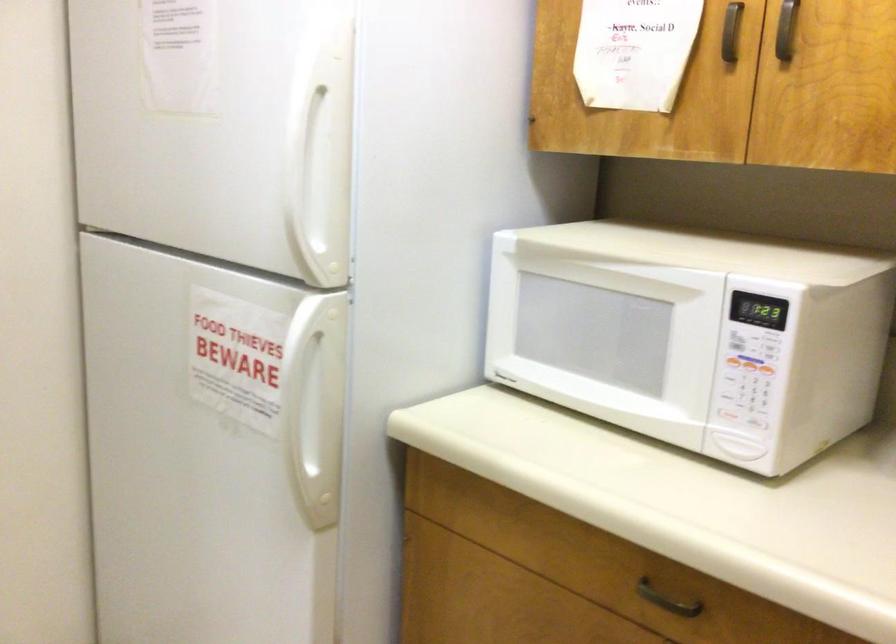
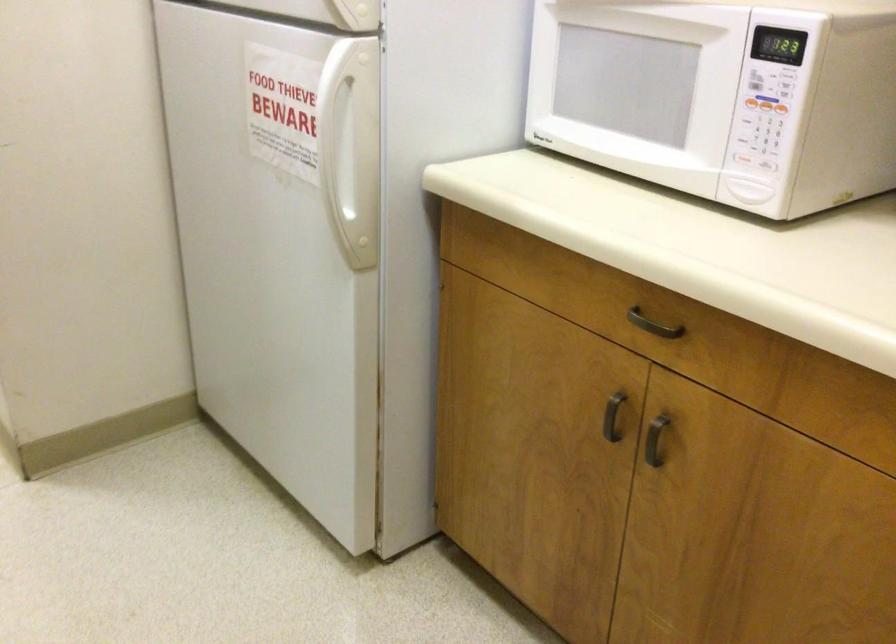
In the second image, find the point that corresponds to the point at 737,363 in the first image.

(752, 102)